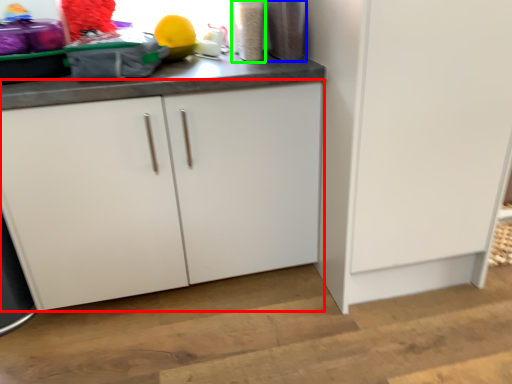
Question: Which object is the closest to the cabinetry (highlighted by a red box)? Choose among these: appliance (highlighted by a blue box) or appliance (highlighted by a green box).

Choices:
 (A) appliance
 (B) appliance

Answer: (B)